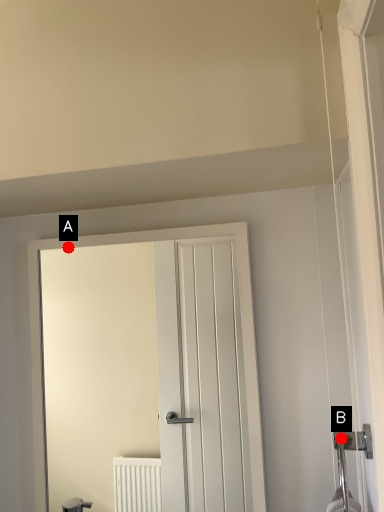
Question: Two points are circled on the image, labeled by A and B beside each circle. Which point appears farthest from the camera in this image?

Choices:
 (A) A is further
 (B) B is further

Answer: (A)